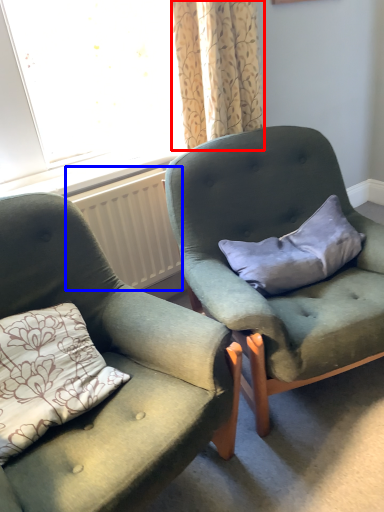
Question: Which point is further to the camera, curtain (highlighted by a red box) or radiator (highlighted by a blue box)?

Choices:
 (A) curtain
 (B) radiator

Answer: (B)